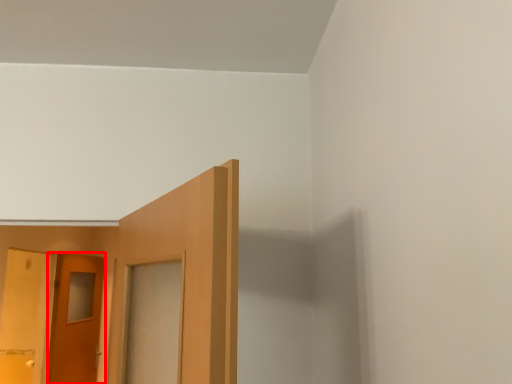
Question: From the image's perspective, considering the relative positions of door (annotated by the red box) and door in the image provided, where is door (annotated by the red box) located with respect to the staircase?

Choices:
 (A) below
 (B) above

Answer: (A)